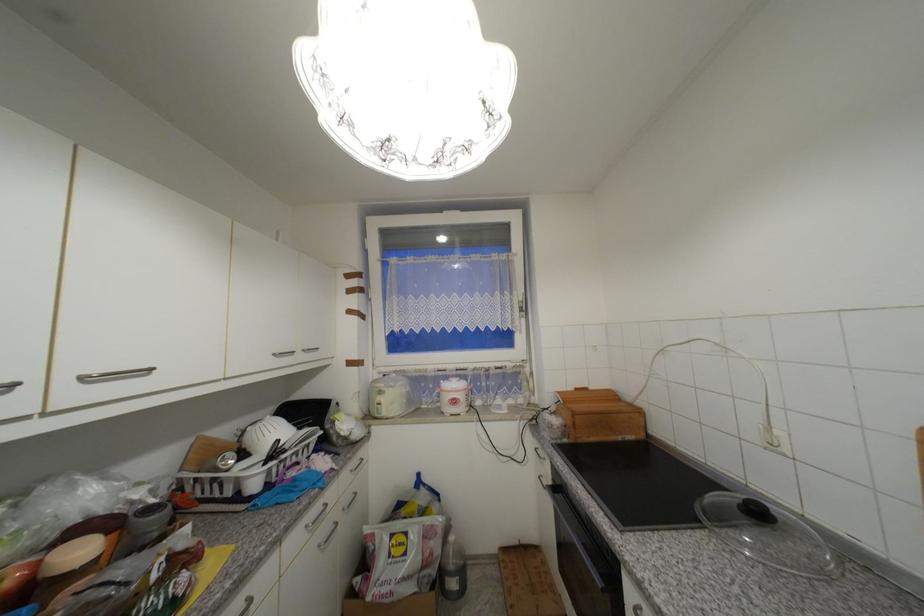
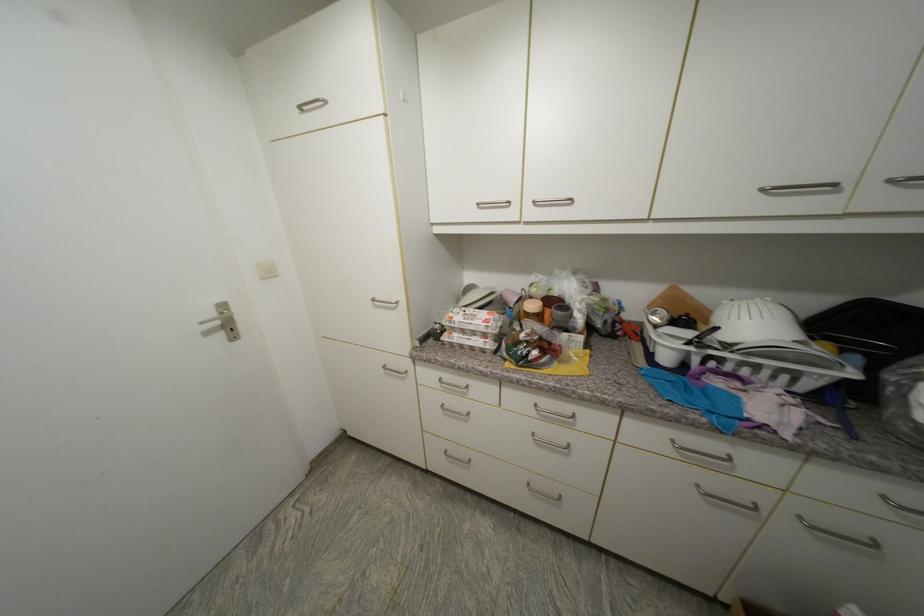
The point at [284,442] is marked in the first image. Where is the corresponding point in the second image?

(723, 330)